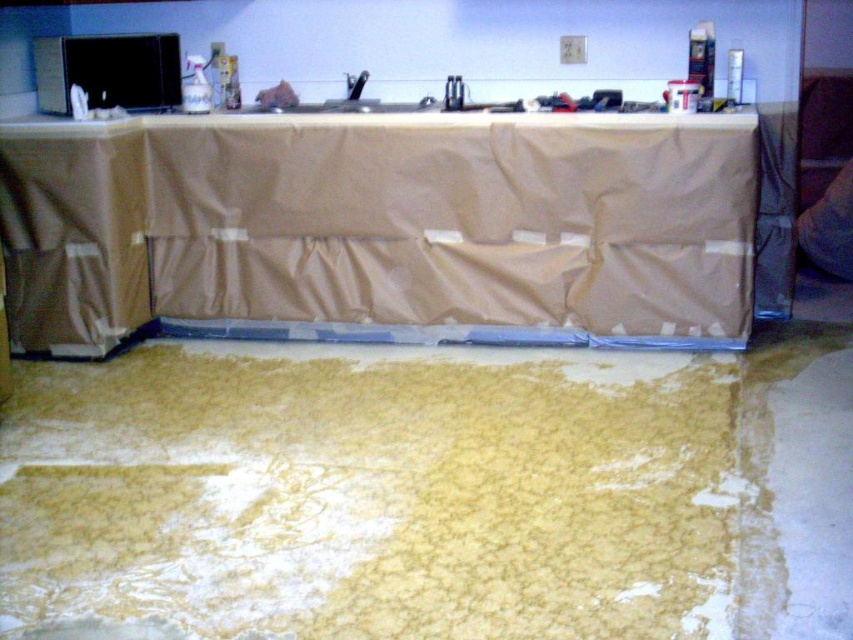
Consider the image. Where is the yellow crumbly food at lower center located in the image?

The yellow crumbly food at lower center is located at point (370,493) in the image.